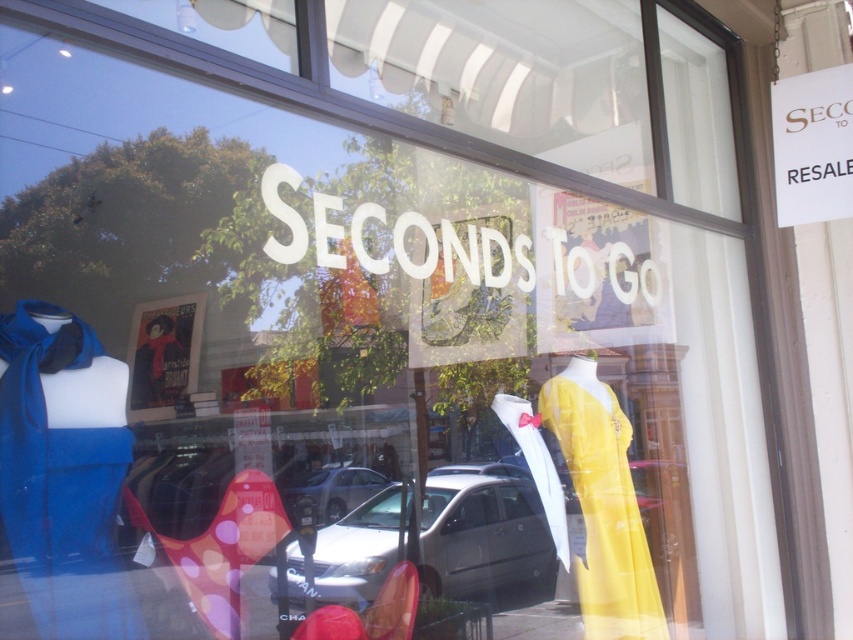
You are standing outside the resale shop looking at the storefront window. There is a point marked at coordinates (483, 532). What object is located at that point?

The silver metallic van at center is located at point (483, 532).

You are a customer standing in front of the store window of Seconds To Go. You notice a silver metallic van at center and a yellow satin dress at center. Which object is positioned more to the left side of the window?

The silver metallic van at center is positioned more to the left side of the window than the yellow satin dress at center.

You are a customer looking at the store window of Seconds To Go. You see a silver metallic van at center and a yellow satin dress at center. Which object is closer to the bottom of the window?

The silver metallic van at center is located below the yellow satin dress at center, so it is closer to the bottom of the window.